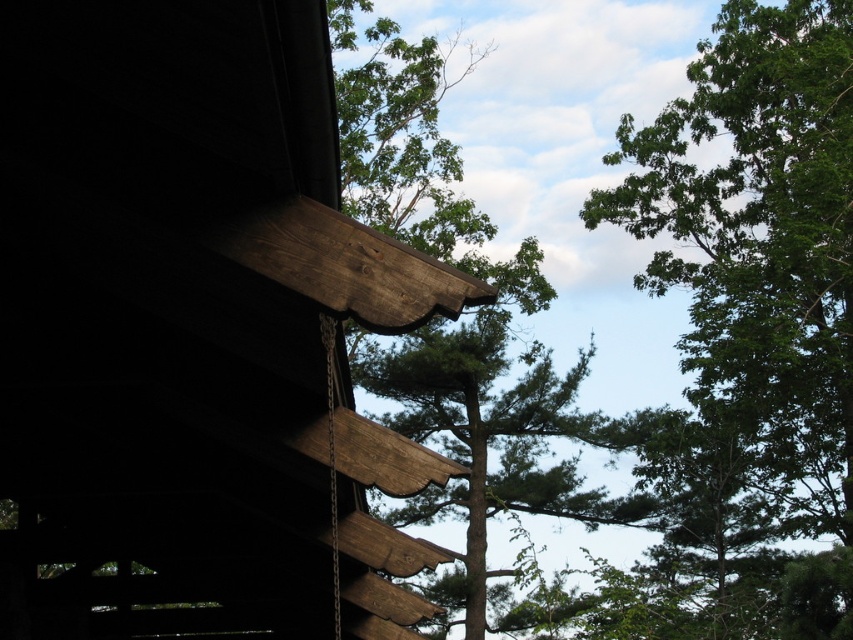
Is dark brown wood cabin at upper left positioned at the back of green leafy tree at upper right?

No.

Between point (148, 164) and point (834, 356), which one is positioned in front?

Point (148, 164)

Find the location of a particular element. This screenshot has width=853, height=640. dark brown wood cabin at upper left is located at coordinates (193, 332).